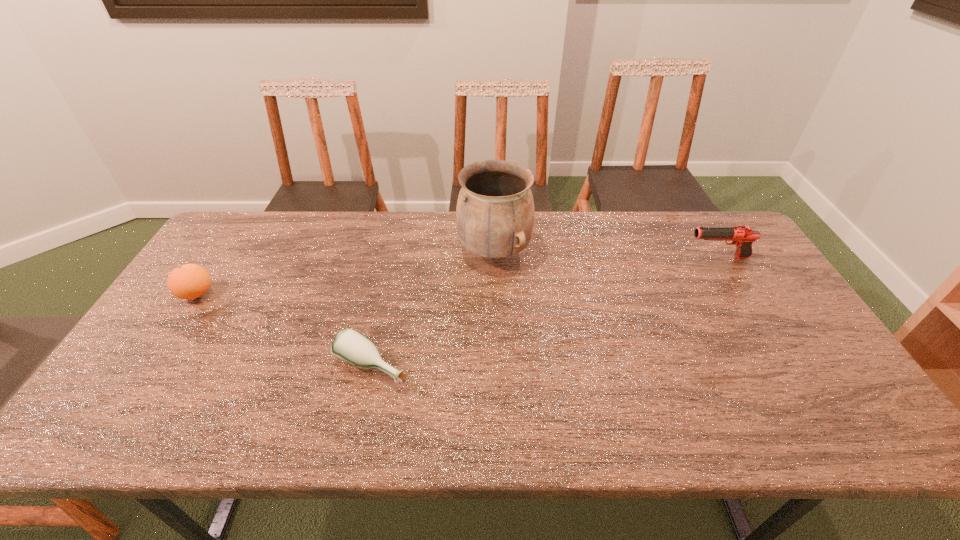
What are the coordinates of `the third object from left to right` in the screenshot? It's located at (495, 212).

Where is `urn`? urn is located at coordinates (495, 212).

The image size is (960, 540). What are the coordinates of `the rightmost object` in the screenshot? It's located at (742, 236).

Where is `the third shortest object`? the third shortest object is located at coordinates (742, 236).

Locate an element on the screen. orange is located at coordinates (190, 281).

Locate an element on the screen. the second nearest object is located at coordinates (190, 281).

Identify the location of the third object from right to left. (349, 345).

Find the location of a particular element. The width and height of the screenshot is (960, 540). bottle is located at coordinates (349, 345).

This screenshot has width=960, height=540. Identify the location of vacant space located on the right of the urn. (581, 253).

Find the location of a particular element. This screenshot has width=960, height=540. free point located at the aiming end of the rightmost object is located at coordinates (583, 258).